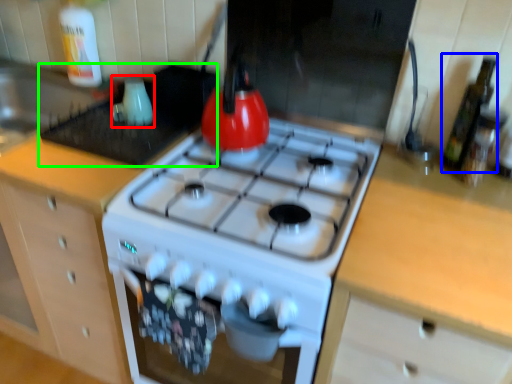
Question: Which object is positioned farthest from appliance (highlighted by a red box)? Select from bottle (highlighted by a blue box) and appliance (highlighted by a green box).

Choices:
 (A) bottle
 (B) appliance

Answer: (A)